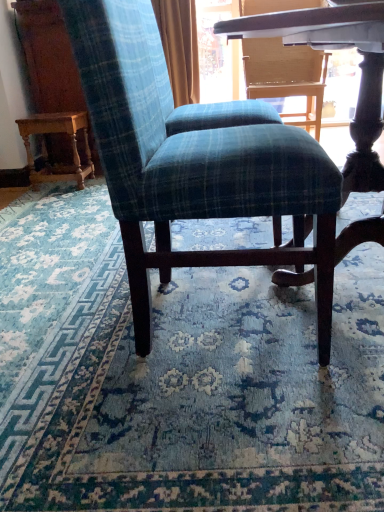
Question: From a real-world perspective, is blue plaid fabric at center positioned over wooden carved table at left based on gravity?

Choices:
 (A) yes
 (B) no

Answer: (B)

Question: Is blue plaid fabric at center smaller than wooden carved table at left?

Choices:
 (A) no
 (B) yes

Answer: (A)

Question: Could you tell me if blue plaid fabric at center is facing wooden carved table at left?

Choices:
 (A) no
 (B) yes

Answer: (A)

Question: From a real-world perspective, is blue plaid fabric at center physically below wooden carved table at left?

Choices:
 (A) no
 (B) yes

Answer: (B)

Question: Is blue plaid fabric at center bigger than wooden carved table at left?

Choices:
 (A) no
 (B) yes

Answer: (B)

Question: From the image's perspective, is blue plaid fabric at center above wooden carved table at left?

Choices:
 (A) yes
 (B) no

Answer: (B)

Question: From a real-world perspective, is plaid fabric chair at center physically above wooden carved table at left?

Choices:
 (A) no
 (B) yes

Answer: (B)

Question: Does plaid fabric chair at center have a larger size compared to wooden carved table at left?

Choices:
 (A) yes
 (B) no

Answer: (A)

Question: Is plaid fabric chair at center wider than wooden carved table at left?

Choices:
 (A) no
 (B) yes

Answer: (B)

Question: Is plaid fabric chair at center thinner than wooden carved table at left?

Choices:
 (A) yes
 (B) no

Answer: (B)

Question: From the image's perspective, is plaid fabric chair at center under wooden carved table at left?

Choices:
 (A) no
 (B) yes

Answer: (B)

Question: Considering the relative sizes of plaid fabric chair at center and wooden carved table at left in the image provided, is plaid fabric chair at center shorter than wooden carved table at left?

Choices:
 (A) no
 (B) yes

Answer: (A)

Question: Is plaid fabric chair at center wider than blue plaid fabric at center?

Choices:
 (A) yes
 (B) no

Answer: (B)